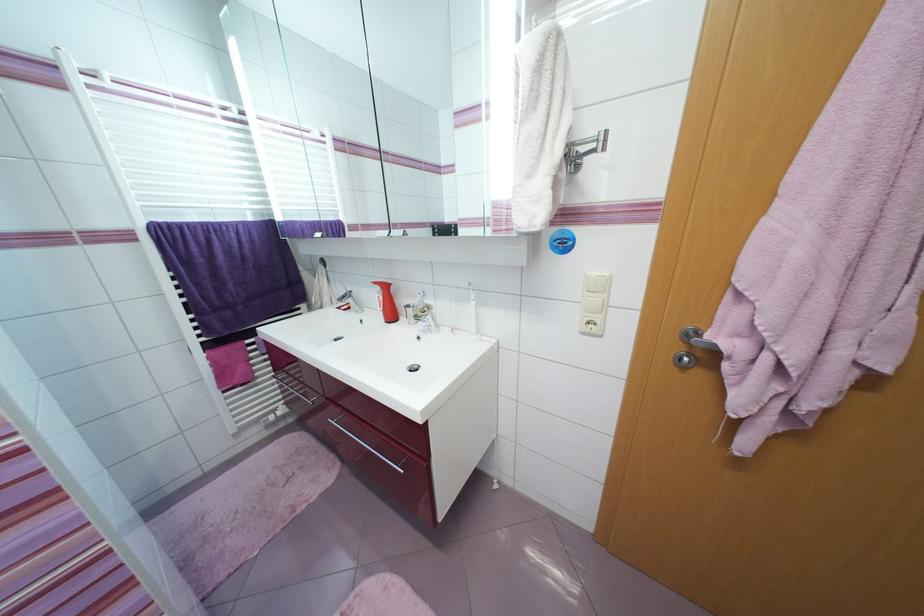
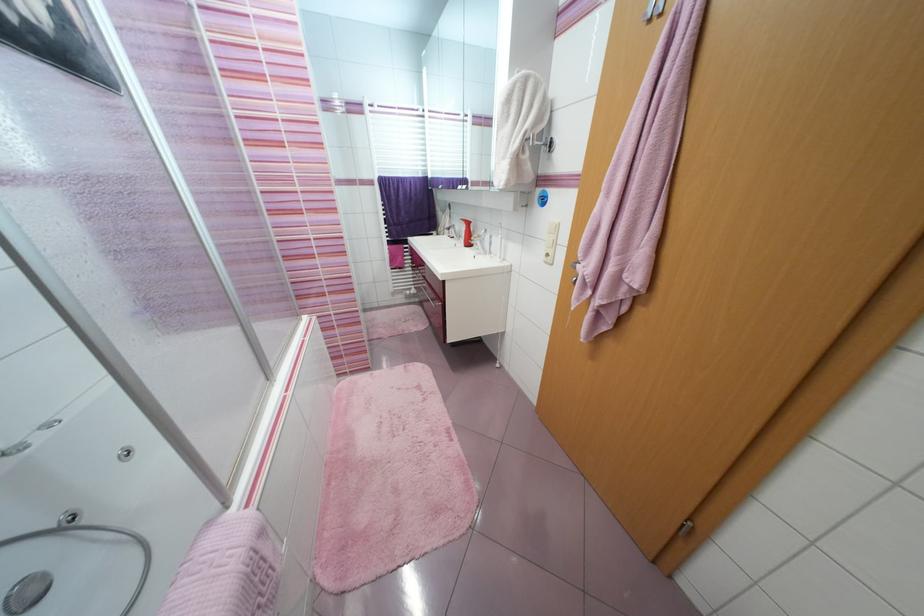
In the second image, find the point that corresponds to point 426,424 in the first image.

(445, 281)